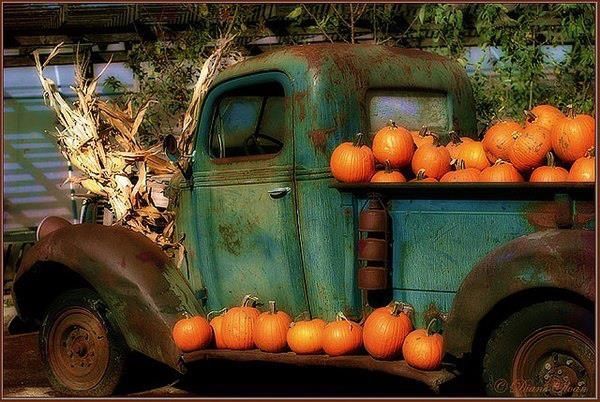
At what (x,y) coordinates should I click in order to perform the action: click on windows. Please return your answer as a coordinate pair (x, y). This screenshot has width=600, height=402. Looking at the image, I should click on (423, 110), (246, 110).